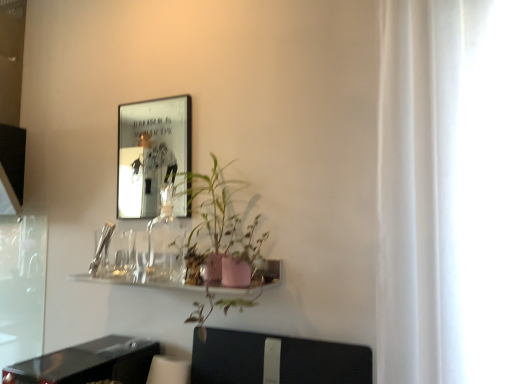
Question: In the image, is metallic reflective frame at upper left positioned in front of or behind pink matte pot at center?

Choices:
 (A) front
 (B) behind

Answer: (B)

Question: In terms of width, does metallic reflective frame at upper left look wider or thinner when compared to pink matte pot at center?

Choices:
 (A) wide
 (B) thin

Answer: (B)

Question: Which object is the closest to the transparent glass screen door at left?

Choices:
 (A) black plastic swivel chair at lower center
 (B) black glossy table at lower left
 (C) metallic reflective frame at upper left
 (D) pink matte pot at center
 (E) pink matte plant pot at center

Answer: (E)

Question: Which of these objects is positioned farthest from the transparent glass screen door at left?

Choices:
 (A) black plastic swivel chair at lower center
 (B) pink matte pot at center
 (C) pink matte plant pot at center
 (D) metallic reflective frame at upper left
 (E) black glossy table at lower left

Answer: (D)